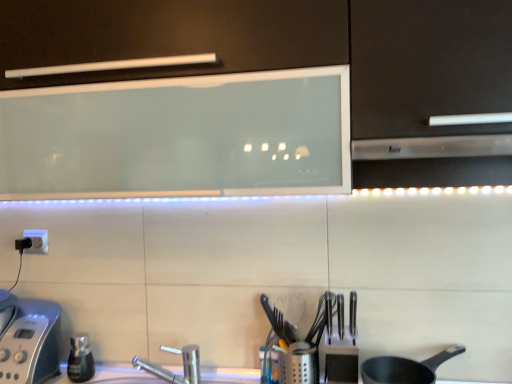
Question: Does matte black frying pan at lower right have a lesser width compared to satin silver exhaust hood at right?

Choices:
 (A) yes
 (B) no

Answer: (A)

Question: Considering the relative positions of matte black frying pan at lower right and satin silver exhaust hood at right in the image provided, is matte black frying pan at lower right behind satin silver exhaust hood at right?

Choices:
 (A) yes
 (B) no

Answer: (A)

Question: Considering the relative sizes of matte black frying pan at lower right and satin silver exhaust hood at right in the image provided, is matte black frying pan at lower right bigger than satin silver exhaust hood at right?

Choices:
 (A) no
 (B) yes

Answer: (A)

Question: Is the surface of matte black frying pan at lower right in direct contact with satin silver exhaust hood at right?

Choices:
 (A) no
 (B) yes

Answer: (A)

Question: From a real-world perspective, does matte black frying pan at lower right stand above satin silver exhaust hood at right?

Choices:
 (A) no
 (B) yes

Answer: (A)

Question: Would you say matte black frying pan at lower right is a long distance from satin silver exhaust hood at right?

Choices:
 (A) yes
 (B) no

Answer: (B)

Question: Is there a large distance between polished metal knives at center and metallic silver utensil holder at center, acting as the 1th appliance starting from the right?

Choices:
 (A) no
 (B) yes

Answer: (A)

Question: Considering the relative positions of polished metal knives at center and metallic silver utensil holder at center, acting as the 1th appliance starting from the right, in the image provided, is polished metal knives at center in front of metallic silver utensil holder at center, acting as the 1th appliance starting from the right,?

Choices:
 (A) no
 (B) yes

Answer: (B)

Question: Is polished metal knives at center oriented towards metallic silver utensil holder at center, acting as the 1th appliance starting from the right?

Choices:
 (A) no
 (B) yes

Answer: (A)

Question: Is polished metal knives at center shorter than metallic silver utensil holder at center, the second appliance when ordered from left to right?

Choices:
 (A) no
 (B) yes

Answer: (B)

Question: Is polished metal knives at center positioned with its back to metallic silver utensil holder at center, acting as the 1th appliance starting from the right?

Choices:
 (A) yes
 (B) no

Answer: (B)

Question: Is polished metal knives at center directly adjacent to metallic silver utensil holder at center, the second appliance when ordered from left to right?

Choices:
 (A) yes
 (B) no

Answer: (B)

Question: From a real-world perspective, is silver metallic faucet at lower center beneath silver metallic toaster at lower left, the 2th appliance from the right?

Choices:
 (A) no
 (B) yes

Answer: (B)